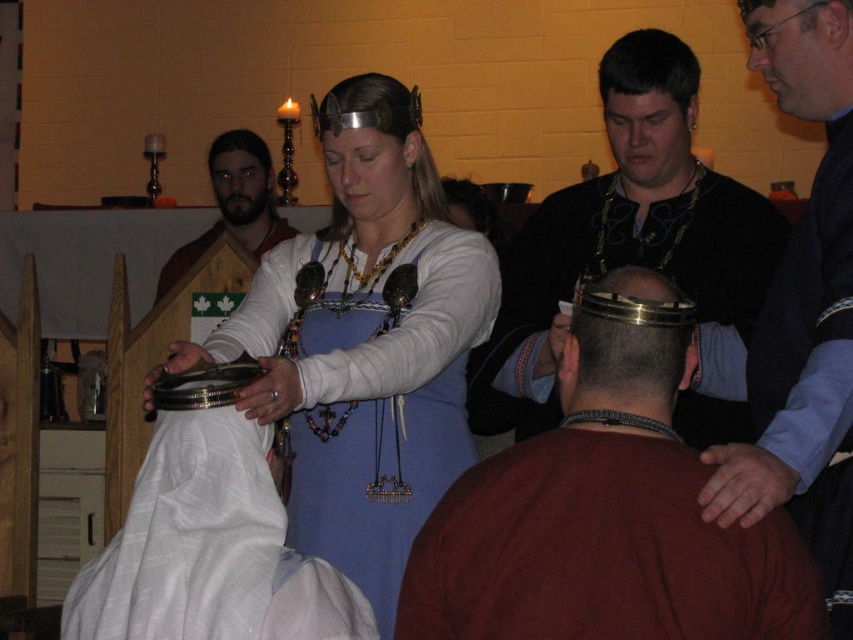
Describe the element at coordinates (627, 342) in the screenshot. I see `gold metallic crown at center` at that location.

Between gold metallic crown at center and brown straight hair at center, which one is positioned higher?

brown straight hair at center

Is point (631, 355) closer to viewer compared to point (259, 163)?

Yes.

Locate an element on the screen. Image resolution: width=853 pixels, height=640 pixels. gold metallic crown at center is located at coordinates (627, 342).

Does matte black head at upper right have a lesser width compared to blonde hair at center?

Correct, matte black head at upper right's width is less than blonde hair at center's.

Looking at this image, measure the distance between matte black head at upper right and camera.

A distance of 6.42 feet exists between matte black head at upper right and camera.

Which is in front, point (780, 36) or point (480, 205)?

Positioned in front is point (780, 36).

Locate an element on the screen. matte black head at upper right is located at coordinates click(801, 52).

Is brown leather belt at center taller than smooth black hair at center?

Yes.

Is brown leather belt at center to the left of smooth black hair at center from the viewer's perspective?

Indeed, brown leather belt at center is positioned on the left side of smooth black hair at center.

Who is more forward, (x=495, y=556) or (x=639, y=76)?

Point (x=495, y=556) is more forward.

Find the location of a particular element. The width and height of the screenshot is (853, 640). brown leather belt at center is located at coordinates (604, 522).